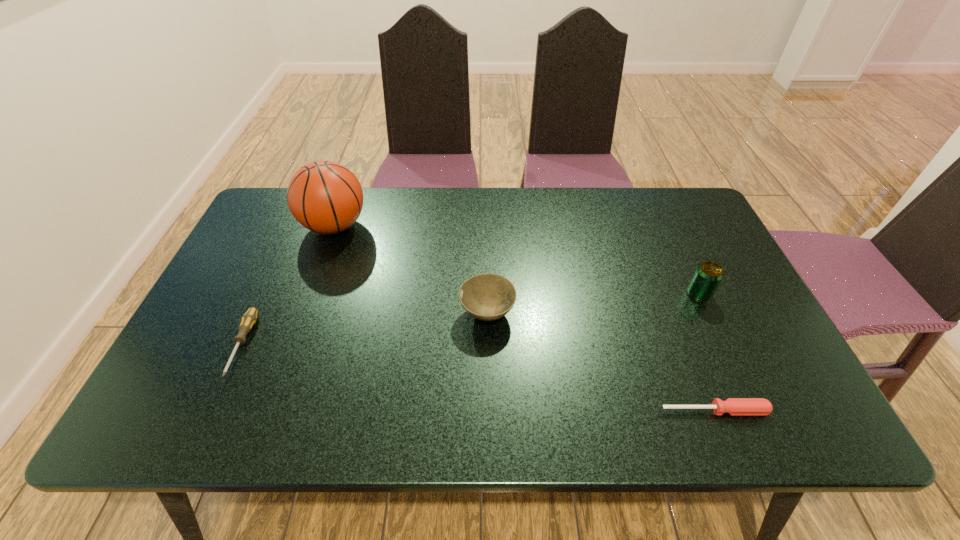
This screenshot has height=540, width=960. What are the coordinates of `object present at the near right corner` in the screenshot? It's located at (733, 406).

In the image, there is a desktop. At what (x,y) coordinates should I click in order to perform the action: click on vacant space at the far edge. Please return your answer as a coordinate pair (x, y). The width and height of the screenshot is (960, 540). Looking at the image, I should click on (491, 199).

Where is `free space at the near edge`? This screenshot has height=540, width=960. free space at the near edge is located at coordinates (357, 395).

You are a GUI agent. You are given a task and a screenshot of the screen. Output one action in this format:
    pyautogui.click(x=<x>, y=<y>)
    Task: Click on the vacant space at the left edge of the desktop
    
    Given the screenshot: What is the action you would take?
    pyautogui.click(x=235, y=342)

At what (x,y) coordinates should I click in order to perform the action: click on blank space at the far right corner of the desktop. Please return your answer as a coordinate pair (x, y). Looking at the image, I should click on (687, 192).

The image size is (960, 540). In order to click on free space between the right screwdriver and the fourth shortest object in this screenshot , I will do `click(707, 352)`.

What are the coordinates of `vacant area that lies between the beer can and the third tallest object` in the screenshot? It's located at (593, 304).

I want to click on empty space that is in between the beer can and the farther screwdriver, so click(470, 319).

Where is `empty space that is in between the left screwdriver and the basketball`? empty space that is in between the left screwdriver and the basketball is located at coordinates (289, 286).

Identify the location of vacant region between the tallest object and the left screwdriver. This screenshot has width=960, height=540. (289, 286).